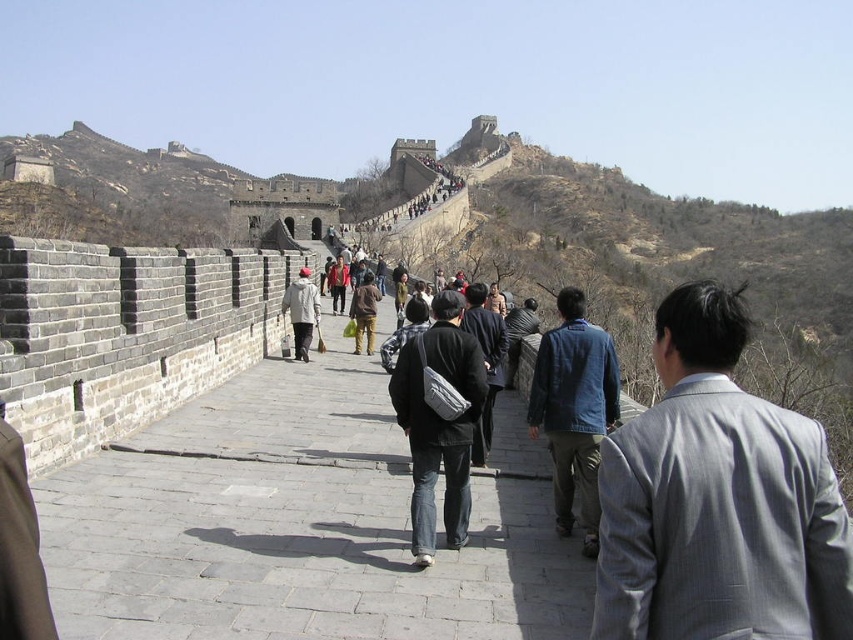
Can you confirm if matte gray bag at center is bigger than brown fabric jacket at center?

Yes.

Measure the distance from matte gray bag at center to brown fabric jacket at center.

73.20 feet

In the scene shown: Who is more distant from viewer, [433,470] or [374,304]?

Point [374,304]

This screenshot has height=640, width=853. Identify the location of matte gray bag at center. (439, 422).

Is point (308, 282) closer to camera compared to point (372, 352)?

Yes, it is.

Which is in front, point (286, 307) or point (355, 316)?

Point (286, 307) is in front.

Is point (310, 312) positioned behind point (366, 324)?

No, it is not.

The image size is (853, 640). Identify the location of light gray wool coat at center. (300, 310).

Can you confirm if gray wool suit at center is smaller than light gray wool coat at center?

Actually, gray wool suit at center might be larger than light gray wool coat at center.

I want to click on gray wool suit at center, so click(717, 499).

You are a GUI agent. You are given a task and a screenshot of the screen. Output one action in this format:
    pyautogui.click(x=<x>, y=<y>)
    Task: Click on the gray wool suit at center
    The image size is (853, 640).
    Given the screenshot: What is the action you would take?
    pyautogui.click(x=717, y=499)